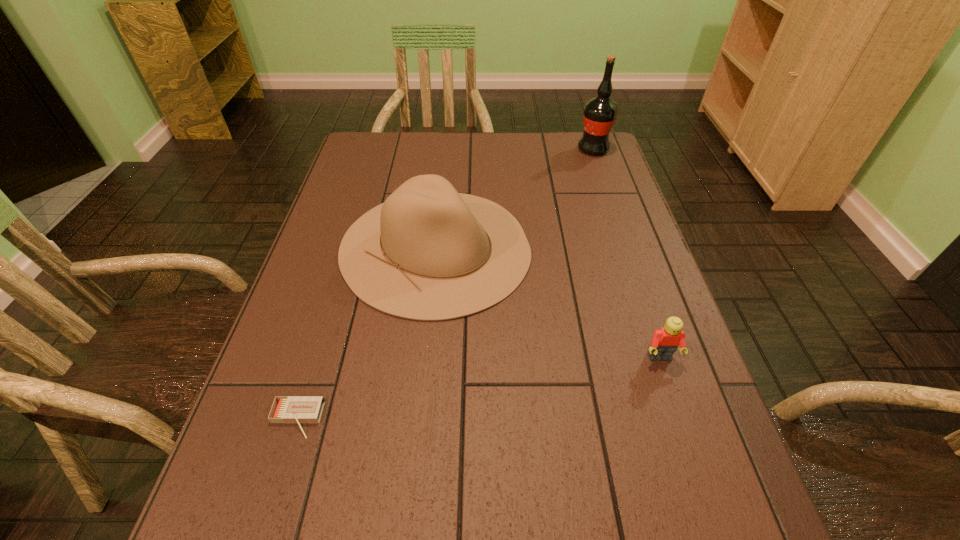
The width and height of the screenshot is (960, 540). What are the coordinates of `the biggest yellow sunflower` in the screenshot? It's located at (426, 155).

You are a GUI agent. You are given a task and a screenshot of the screen. Output one action in this format:
    pyautogui.click(x=<x>, y=<y>)
    Task: Click on the tallest sunflower
    Image resolution: width=960 pixels, height=540 pixels.
    Given the screenshot: What is the action you would take?
    pyautogui.click(x=426, y=155)

Find the location of `the third smallest yellow sunflower`. the third smallest yellow sunflower is located at coordinates (529, 178).

Find the location of a particular element. the left green sunflower is located at coordinates (505, 259).

Where is `the bigger green sunflower`? the bigger green sunflower is located at coordinates 505,259.

You are a GUI agent. You are given a task and a screenshot of the screen. Output one action in this format:
    pyautogui.click(x=<x>, y=<y>)
    Task: Click on the nearer green sunflower
    
    Given the screenshot: What is the action you would take?
    pyautogui.click(x=613, y=293)

The height and width of the screenshot is (540, 960). In order to click on the smaller green sunflower in this screenshot , I will do `click(613, 293)`.

This screenshot has width=960, height=540. I want to click on the third biggest yellow sunflower, so click(356, 288).

Find the location of a particular element. The height and width of the screenshot is (540, 960). sponge is located at coordinates (470, 431).

Where is `the smallest yellow sunflower`? The image size is (960, 540). the smallest yellow sunflower is located at coordinates 654,401.